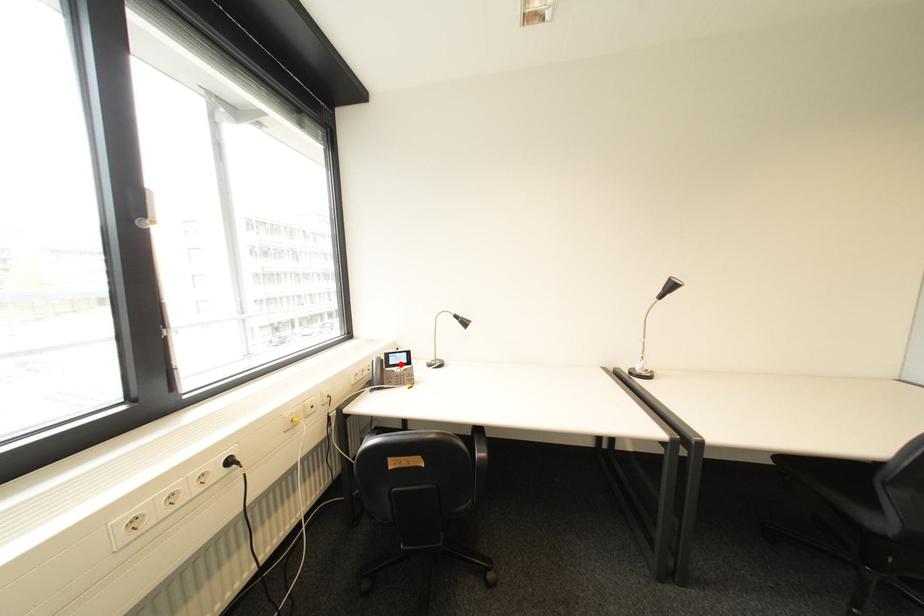
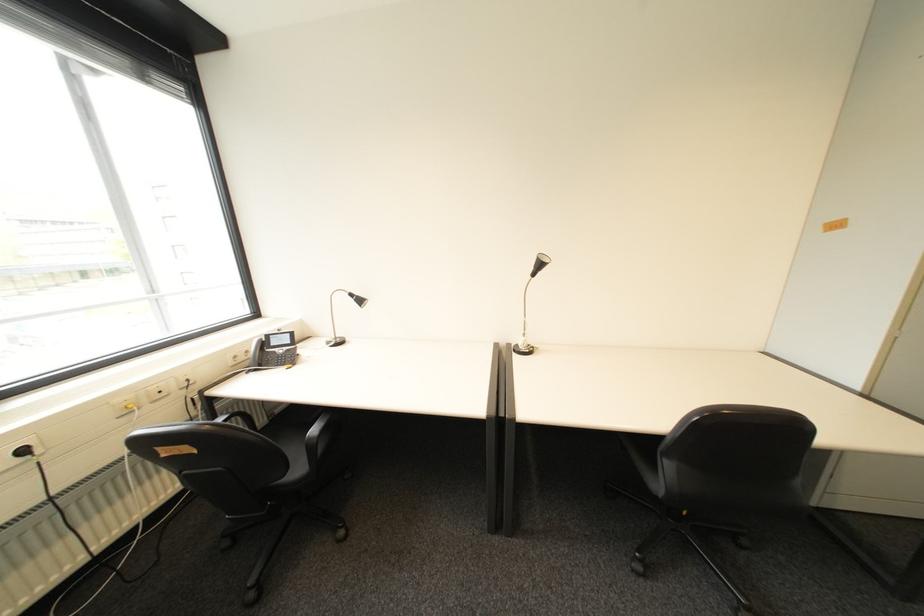
Question: I am providing you with two images of the same scene from different viewpoints. Image1 has a red point marked. In image2, the corresponding 3D location appears at what relative position? Reply with the corresponding letter.

Choices:
 (A) Closer
 (B) Farther

Answer: (A)